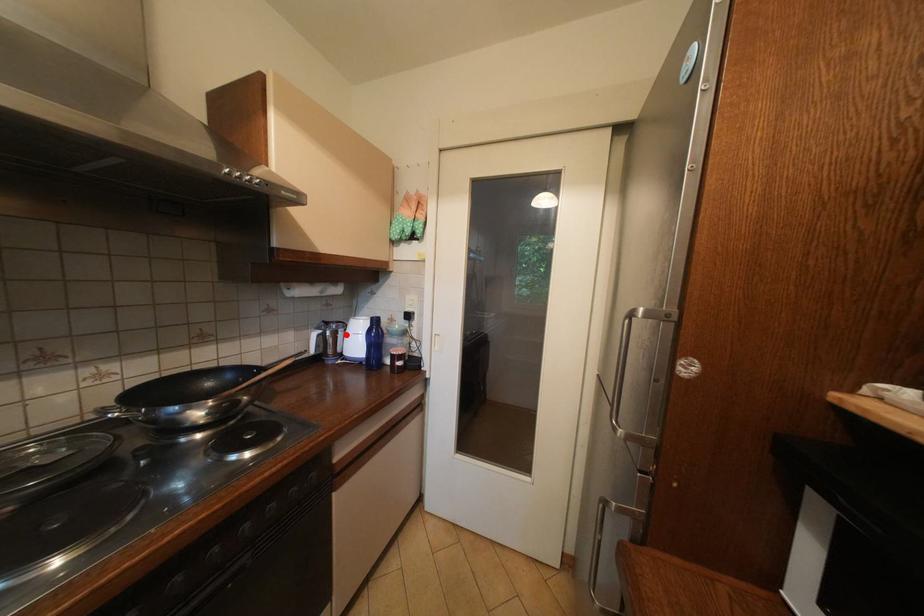
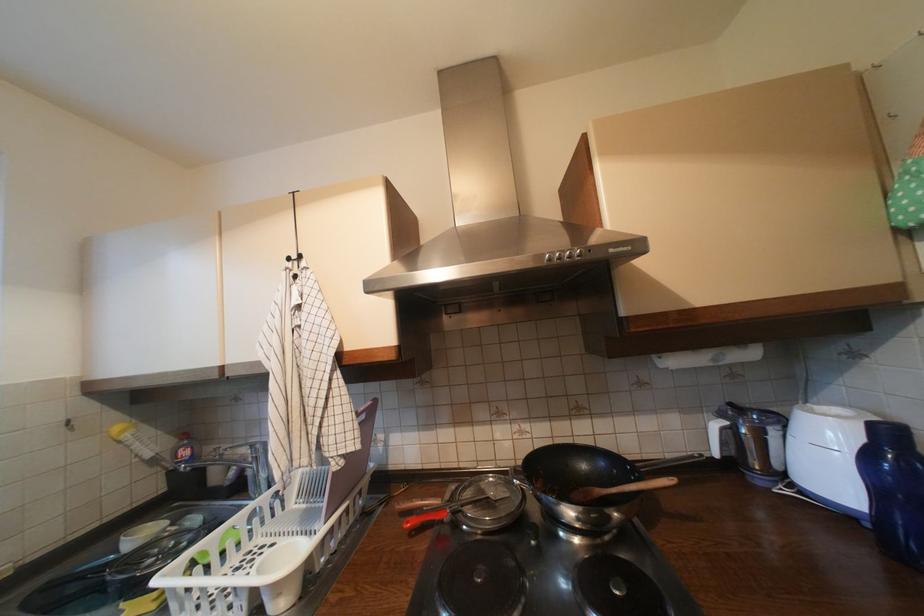
Question: I am providing you with two images of the same scene from different viewpoints. A red point is marked on the first image. Can you still see the location of the red point in image 2?

Choices:
 (A) Yes
 (B) No

Answer: (A)